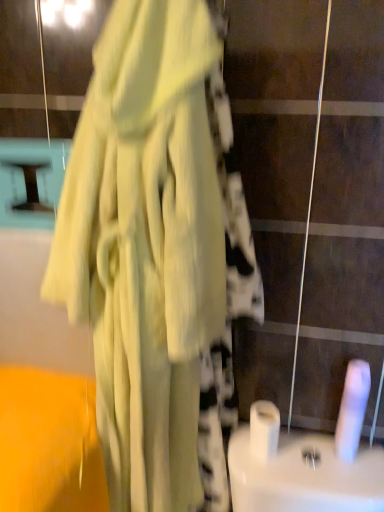
Question: Do you think matte yellow dress at center is within white glossy toilet paper at center, placed as the 1th toilet paper when sorted from left to right, or outside of it?

Choices:
 (A) outside
 (B) inside

Answer: (A)

Question: Considering the positions of matte yellow dress at center and white glossy toilet paper at center, placed as the 1th toilet paper when sorted from left to right, in the image, is matte yellow dress at center taller or shorter than white glossy toilet paper at center, placed as the 1th toilet paper when sorted from left to right,?

Choices:
 (A) short
 (B) tall

Answer: (B)

Question: Based on their relative distances, which object is farther from the white glossy toilet paper at center, placed as the second toilet paper when sorted from right to left?

Choices:
 (A) matte yellow dress at center
 (B) white matte toilet paper at lower right, the first toilet paper when ordered from right to left

Answer: (A)

Question: Considering the real-world distances, which object is farthest from the matte yellow dress at center?

Choices:
 (A) white matte toilet paper at lower right, which ranks as the second toilet paper in left-to-right order
 (B) white glossy toilet paper at center, placed as the second toilet paper when sorted from right to left

Answer: (A)